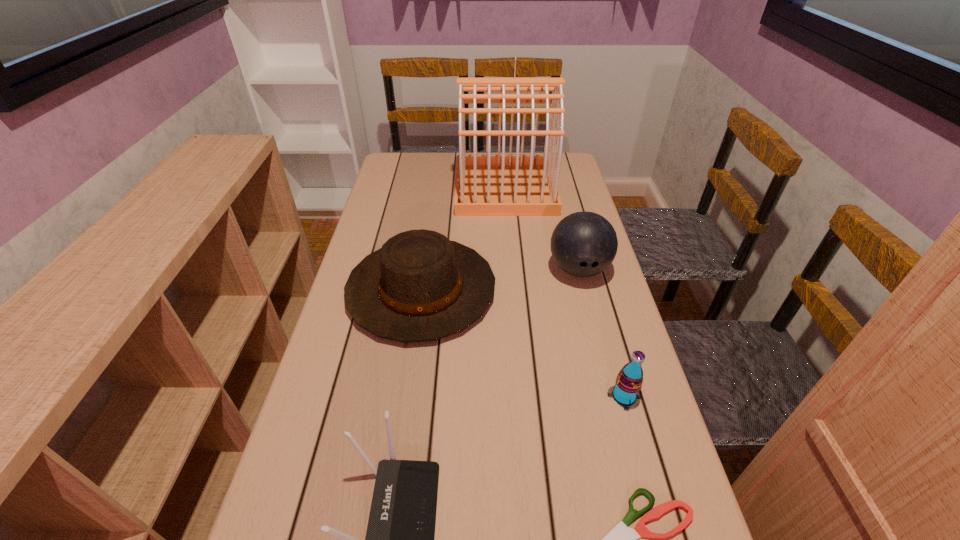
In order to click on vacant space at the far left corner of the desktop in this screenshot , I will do `click(391, 157)`.

Locate an element on the screen. vacant space in between the cowboy hat and the farthest object is located at coordinates (464, 239).

Find the location of a particular element. vacant space that's between the soda and the bowling ball is located at coordinates (601, 333).

I want to click on the second closest object to the farthest object, so click(583, 244).

Identify which object is the third closest to the router. Please provide its 2D coordinates. Your answer should be formatted as a tuple, i.e. [(x, y)], where the tuple contains the x and y coordinates of a point satisfying the conditions above.

[(627, 389)]

Find the location of `vacant space that satisfies the following two spatial constraints: 1. on the front side of the soda; 2. on the right side of the cowboy hat`. vacant space that satisfies the following two spatial constraints: 1. on the front side of the soda; 2. on the right side of the cowboy hat is located at coordinates (406, 396).

At what (x,y) coordinates should I click in order to perform the action: click on free region that satisfies the following two spatial constraints: 1. on the grip area of the bowling ball; 2. on the right side of the soda. Please return your answer as a coordinate pair (x, y). The width and height of the screenshot is (960, 540). Looking at the image, I should click on (611, 396).

Locate an element on the screen. The width and height of the screenshot is (960, 540). vacant space that satisfies the following two spatial constraints: 1. with an open door on the birdcage; 2. on the left side of the soda is located at coordinates (522, 396).